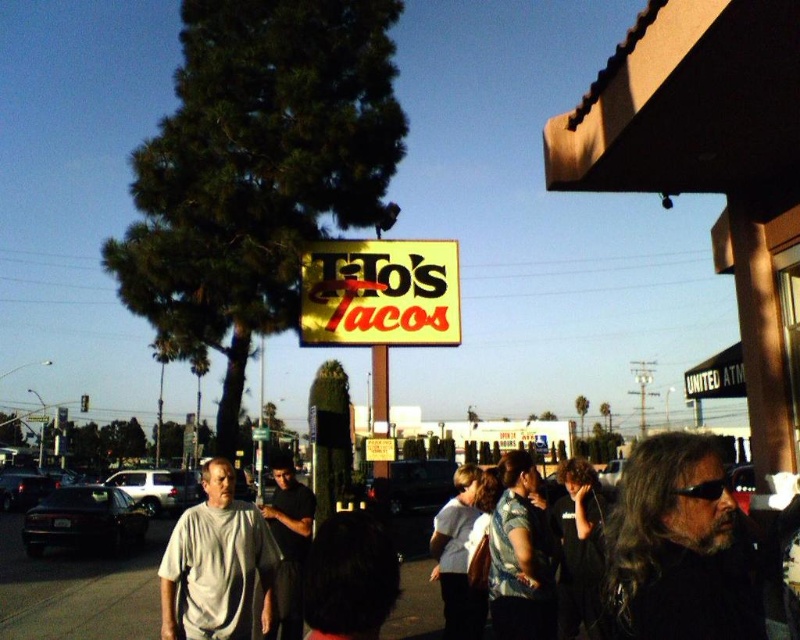
Is yellow plastic sign at center wider than dark gray shirt at center?

Yes.

What do you see at coordinates (380, 292) in the screenshot? I see `yellow plastic sign at center` at bounding box center [380, 292].

Image resolution: width=800 pixels, height=640 pixels. I want to click on yellow plastic sign at center, so click(380, 292).

Between point (648, 490) and point (366, 333), which one is positioned in front?

Point (648, 490) is more forward.

Can you confirm if dark brown hair at center is taller than yellow plastic sign at center?

No.

This screenshot has width=800, height=640. Describe the element at coordinates (680, 547) in the screenshot. I see `dark brown hair at center` at that location.

At what (x,y) coordinates should I click in order to perform the action: click on dark brown hair at center. Please return your answer as a coordinate pair (x, y). The height and width of the screenshot is (640, 800). Looking at the image, I should click on (680, 547).

Is dark brown hair at center positioned behind white matte shirt at center?

No, dark brown hair at center is in front of white matte shirt at center.

Where is `dark brown hair at center`? dark brown hair at center is located at coordinates (680, 547).